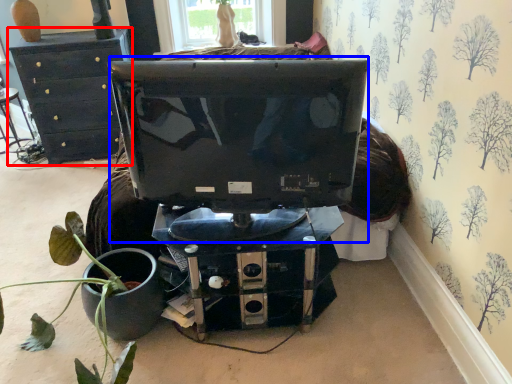
Question: Among these objects, which one is farthest to the camera, furniture (highlighted by a red box) or computer monitor (highlighted by a blue box)?

Choices:
 (A) furniture
 (B) computer monitor

Answer: (A)